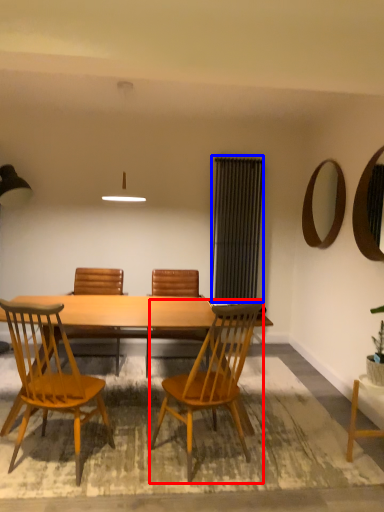
Question: Which object appears farthest to the camera in this image, chair (highlighted by a red box) or screen door (highlighted by a blue box)?

Choices:
 (A) chair
 (B) screen door

Answer: (B)